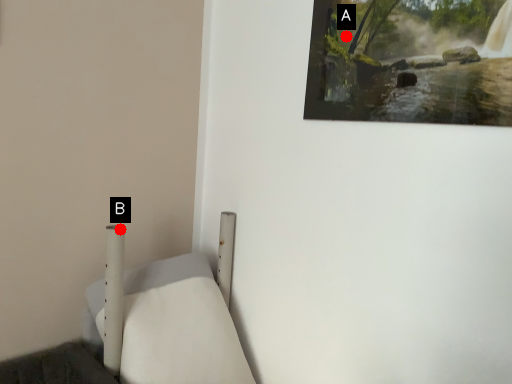
Question: Two points are circled on the image, labeled by A and B beside each circle. Which of the following is the farthest from the observer?

Choices:
 (A) A is further
 (B) B is further

Answer: (B)